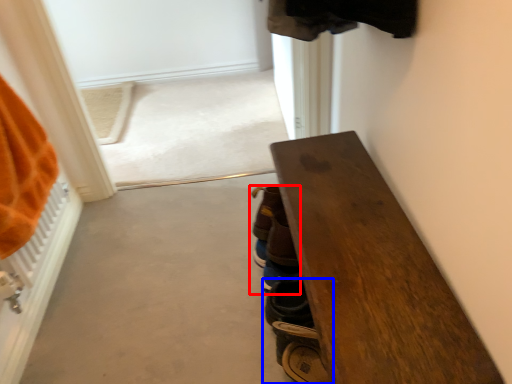
Question: Which of the following is the closest to the observer, footwear (highlighted by a red box) or footwear (highlighted by a blue box)?

Choices:
 (A) footwear
 (B) footwear

Answer: (B)